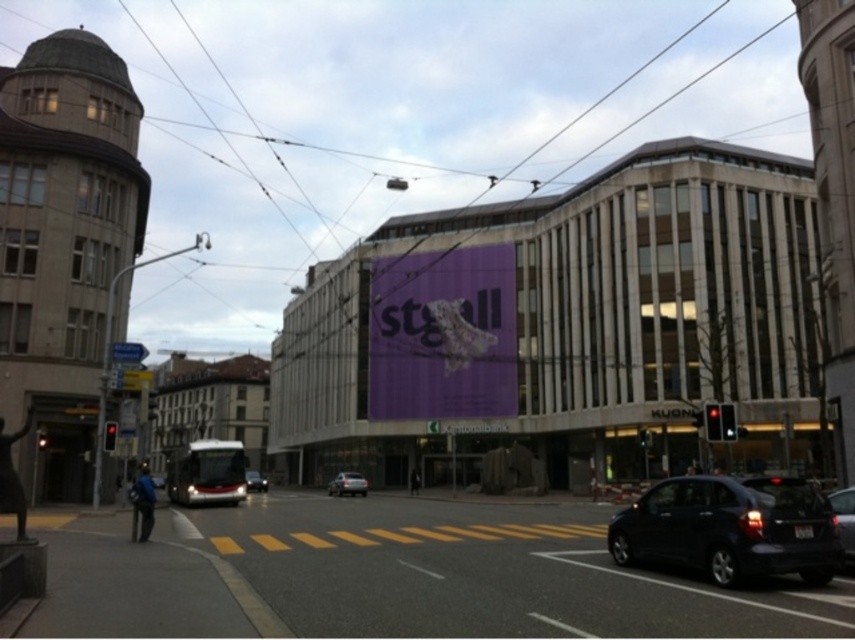
Question: Which point appears farthest from the camera in this image?

Choices:
 (A) (691, 522)
 (B) (329, 486)

Answer: (B)

Question: Is silver metallic car at center above shiny silver bus at center?

Choices:
 (A) no
 (B) yes

Answer: (B)

Question: Which object is positioned farthest from the purple matte billboard at center?

Choices:
 (A) silver metallic car at center
 (B) shiny black sedan at lower right
 (C) shiny silver bus at center
 (D) shiny black car at lower right

Answer: (B)

Question: Observing the image, what is the correct spatial positioning of shiny black car at lower right in reference to silver metallic car at center?

Choices:
 (A) right
 (B) left

Answer: (A)

Question: Can you confirm if silver metallic car at center is bigger than shiny silver bus at center?

Choices:
 (A) yes
 (B) no

Answer: (B)

Question: Which is farther from the silver metallic car at center?

Choices:
 (A) purple matte billboard at center
 (B) shiny silver bus at center

Answer: (A)